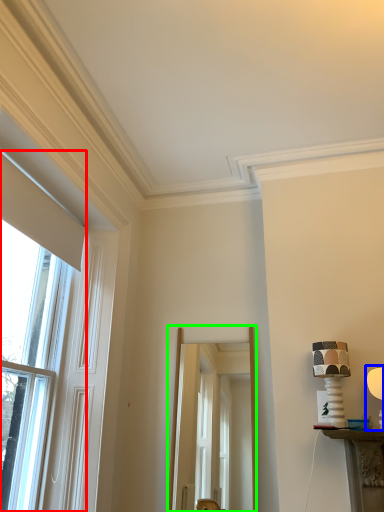
Question: Estimate the real-world distances between objects in this image. Which object is closer to window (highlighted by a red box), table lamp (highlighted by a blue box) or screen door (highlighted by a green box)?

Choices:
 (A) table lamp
 (B) screen door

Answer: (B)